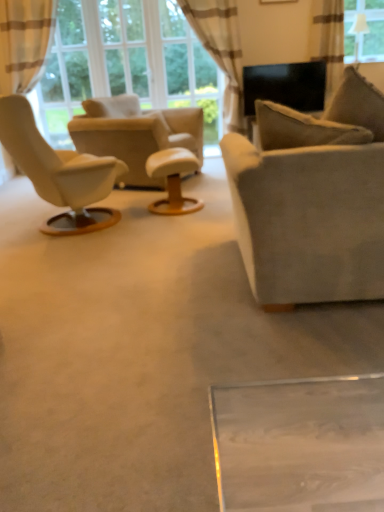
Find the location of a particular element. satin beige curtain at upper right, positioned as the 3th curtain in left-to-right order is located at coordinates (328, 41).

In order to face transparent glass window at upper right, should I rotate leftwards or rightwards?

Turn right approximately 22.207 degrees to face it.

Image resolution: width=384 pixels, height=512 pixels. I want to click on beige striped curtain at upper center, which is counted as the 2th curtain, starting from the right, so click(221, 50).

The height and width of the screenshot is (512, 384). What do you see at coordinates (173, 180) in the screenshot?
I see `white leather ottoman at center` at bounding box center [173, 180].

You are a GUI agent. You are given a task and a screenshot of the screen. Output one action in this format:
    pyautogui.click(x=<x>, y=<y>)
    Task: Click on the suede couch at center
    This screenshot has width=384, height=512.
    Given the screenshot: What is the action you would take?
    pyautogui.click(x=312, y=198)

How many degrees apart are the facing directions of suede beige chair at center and beige striped curtain at upper center, which is counted as the 2th curtain, starting from the left?

The angular difference between suede beige chair at center and beige striped curtain at upper center, which is counted as the 2th curtain, starting from the left, is 63.2 degrees.

Would you say suede beige chair at center is outside beige striped curtain at upper center, which is counted as the 2th curtain, starting from the left?

suede beige chair at center is positioned outside beige striped curtain at upper center, which is counted as the 2th curtain, starting from the left.

In terms of height, does suede beige chair at center look taller or shorter compared to beige striped curtain at upper center, which is counted as the 2th curtain, starting from the right?

Clearly, suede beige chair at center is shorter compared to beige striped curtain at upper center, which is counted as the 2th curtain, starting from the right.

Are suede beige chair at center and beige striped curtain at upper center, which is counted as the 2th curtain, starting from the left, beside each other?

No, suede beige chair at center is not beside beige striped curtain at upper center, which is counted as the 2th curtain, starting from the left.

From a real-world perspective, is white leather ottoman at center located beneath suede beige chair at center?

Yes.

Considering the relative positions of white leather ottoman at center and suede beige chair at center in the image provided, is white leather ottoman at center to the left of suede beige chair at center from the viewer's perspective?

No.

Is point (177, 172) positioned in front of point (79, 128)?

That is True.

Considering the sizes of white leather ottoman at center and suede beige chair at center in the image, is white leather ottoman at center wider or thinner than suede beige chair at center?

Considering their sizes, white leather ottoman at center looks slimmer than suede beige chair at center.

How different are the orientations of satin beige curtain at upper right, the first curtain in the right-to-left sequence, and suede beige chair at center in degrees?

63.4 degrees.

Is satin beige curtain at upper right, positioned as the 3th curtain in left-to-right order, oriented away from suede beige chair at center?

No, satin beige curtain at upper right, positioned as the 3th curtain in left-to-right order,'s orientation is not away from suede beige chair at center.

Where is `curtain that is the 3rd object located behind the suede beige chair at center`? curtain that is the 3rd object located behind the suede beige chair at center is located at coordinates (328, 41).

Is there a large distance between satin beige curtain at upper right, positioned as the 3th curtain in left-to-right order, and beige striped curtain at upper center, which is counted as the 2th curtain, starting from the right?

That's not correct — satin beige curtain at upper right, positioned as the 3th curtain in left-to-right order, is a little close to beige striped curtain at upper center, which is counted as the 2th curtain, starting from the right.

Looking at this image, is satin beige curtain at upper right, the first curtain in the right-to-left sequence, inside the boundaries of beige striped curtain at upper center, which is counted as the 2th curtain, starting from the left, or outside?

satin beige curtain at upper right, the first curtain in the right-to-left sequence, is not inside beige striped curtain at upper center, which is counted as the 2th curtain, starting from the left, it's outside.

In the image, there is a beige striped curtain at upper center, which is counted as the 2th curtain, starting from the left. Where is `curtain above it (from the image's perspective)`? This screenshot has width=384, height=512. curtain above it (from the image's perspective) is located at coordinates (328, 41).

How different are the orientations of matte black picture frame at upper center and beige striped curtain at upper center, which is counted as the 2th curtain, starting from the right, in degrees?

They differ by 0.226 degrees in their facing directions.

From the image's perspective, would you say matte black picture frame at upper center is shown under beige striped curtain at upper center, which is counted as the 2th curtain, starting from the right?

Incorrect, from the image's perspective, matte black picture frame at upper center is higher than beige striped curtain at upper center, which is counted as the 2th curtain, starting from the right.

Does matte black picture frame at upper center touch beige striped curtain at upper center, which is counted as the 2th curtain, starting from the right?

No, matte black picture frame at upper center is not making contact with beige striped curtain at upper center, which is counted as the 2th curtain, starting from the right.

Considering the relative positions of matte black picture frame at upper center and beige striped curtain at upper center, which is counted as the 2th curtain, starting from the right, in the image provided, is matte black picture frame at upper center in front of beige striped curtain at upper center, which is counted as the 2th curtain, starting from the right,?

That is False.

Is the position of satin beige curtain at upper right, positioned as the 3th curtain in left-to-right order, less distant than that of beige fabric curtain at left, the 1th curtain positioned from the left?

No, satin beige curtain at upper right, positioned as the 3th curtain in left-to-right order, is further to the viewer.

Which object is wider, satin beige curtain at upper right, the first curtain in the right-to-left sequence, or beige fabric curtain at left, which is the 3th curtain in right-to-left order?

With larger width is beige fabric curtain at left, which is the 3th curtain in right-to-left order.

How different are the orientations of satin beige curtain at upper right, the first curtain in the right-to-left sequence, and beige fabric curtain at left, the 1th curtain positioned from the left, in degrees?

0.223 degrees separate the facing orientations of satin beige curtain at upper right, the first curtain in the right-to-left sequence, and beige fabric curtain at left, the 1th curtain positioned from the left.

Between satin beige curtain at upper right, positioned as the 3th curtain in left-to-right order, and beige fabric curtain at left, the 1th curtain positioned from the left, which one appears on the right side from the viewer's perspective?

satin beige curtain at upper right, positioned as the 3th curtain in left-to-right order.

Who is more distant, beige striped curtain at upper center, which is counted as the 2th curtain, starting from the right, or beige fabric curtain at left, which is the 3th curtain in right-to-left order?

Positioned behind is beige striped curtain at upper center, which is counted as the 2th curtain, starting from the right.

From the image's perspective, which is below, beige striped curtain at upper center, which is counted as the 2th curtain, starting from the right, or beige fabric curtain at left, the 1th curtain positioned from the left?

beige fabric curtain at left, the 1th curtain positioned from the left, is shown below in the image.

Is beige fabric curtain at left, the 1th curtain positioned from the left, at the back of beige striped curtain at upper center, which is counted as the 2th curtain, starting from the right?

No, beige striped curtain at upper center, which is counted as the 2th curtain, starting from the right,'s orientation is not away from beige fabric curtain at left, the 1th curtain positioned from the left.

Measure the distance between beige striped curtain at upper center, which is counted as the 2th curtain, starting from the left, and beige fabric curtain at left, the 1th curtain positioned from the left.

beige striped curtain at upper center, which is counted as the 2th curtain, starting from the left, and beige fabric curtain at left, the 1th curtain positioned from the left, are 1.89 meters apart from each other.

From the image's perspective, starting from the suede beige chair at center, which curtain is the 2nd one above? Please provide its 2D coordinates.

[(221, 50)]

Find the location of a particular element. chair located behind the white leather ottoman at center is located at coordinates (135, 133).

From the image, which object appears to be farther from beige fabric curtain at left, which is the 3th curtain in right-to-left order, beige striped curtain at upper center, which is counted as the 2th curtain, starting from the right, or matte black picture frame at upper center?

matte black picture frame at upper center lies further to beige fabric curtain at left, which is the 3th curtain in right-to-left order, than the other object.

Considering their positions, is matte black picture frame at upper center positioned further to white leather ottoman at center than beige fabric curtain at left, the 1th curtain positioned from the left?

beige fabric curtain at left, the 1th curtain positioned from the left.

Considering their positions, is matte black picture frame at upper center positioned closer to suede beige chair at center than beige fabric curtain at left, which is the 3th curtain in right-to-left order?

Based on the image, beige fabric curtain at left, which is the 3th curtain in right-to-left order, appears to be nearer to suede beige chair at center.

In the scene shown: Considering their positions, is matte black picture frame at upper center positioned further to white leather ottoman at center than suede couch at center?

Based on the image, matte black picture frame at upper center appears to be further to white leather ottoman at center.

When comparing their distances from suede couch at center, does transparent glass window at upper right or satin beige curtain at upper right, positioned as the 3th curtain in left-to-right order, seem closer?

satin beige curtain at upper right, positioned as the 3th curtain in left-to-right order, is positioned closer to the anchor suede couch at center.

Looking at the image, which one is located further to beige striped curtain at upper center, which is counted as the 2th curtain, starting from the right, satin beige curtain at upper right, the first curtain in the right-to-left sequence, or beige fabric curtain at left, the 1th curtain positioned from the left?

The object further to beige striped curtain at upper center, which is counted as the 2th curtain, starting from the right, is beige fabric curtain at left, the 1th curtain positioned from the left.

Estimate the real-world distances between objects in this image. Which object is closer to suede couch at center, white leather ottoman at center or satin beige curtain at upper right, positioned as the 3th curtain in left-to-right order?

white leather ottoman at center is positioned closer to the anchor suede couch at center.

When comparing their distances from satin beige curtain at upper right, positioned as the 3th curtain in left-to-right order, does beige striped curtain at upper center, which is counted as the 2th curtain, starting from the left, or white leather ottoman at center seem closer?

Among the two, beige striped curtain at upper center, which is counted as the 2th curtain, starting from the left, is located nearer to satin beige curtain at upper right, positioned as the 3th curtain in left-to-right order.

You are a GUI agent. You are given a task and a screenshot of the screen. Output one action in this format:
    pyautogui.click(x=<x>, y=<y>)
    Task: Click on the round table positioned between suede couch at center and satin beige curtain at upper right, positioned as the 3th curtain in left-to-right order, from near to far
    This screenshot has width=384, height=512.
    Given the screenshot: What is the action you would take?
    pyautogui.click(x=173, y=180)

Where is `chair between suede couch at center and beige fabric curtain at left, which is the 3th curtain in right-to-left order, from front to back`? The height and width of the screenshot is (512, 384). chair between suede couch at center and beige fabric curtain at left, which is the 3th curtain in right-to-left order, from front to back is located at coordinates (135, 133).

Where is `chair between beige fabric curtain at left, the 1th curtain positioned from the left, and transparent glass window at upper right from left to right`? This screenshot has width=384, height=512. chair between beige fabric curtain at left, the 1th curtain positioned from the left, and transparent glass window at upper right from left to right is located at coordinates (135, 133).

Image resolution: width=384 pixels, height=512 pixels. I want to click on chair between suede couch at center and transparent glass window at upper right in the front-back direction, so click(135, 133).